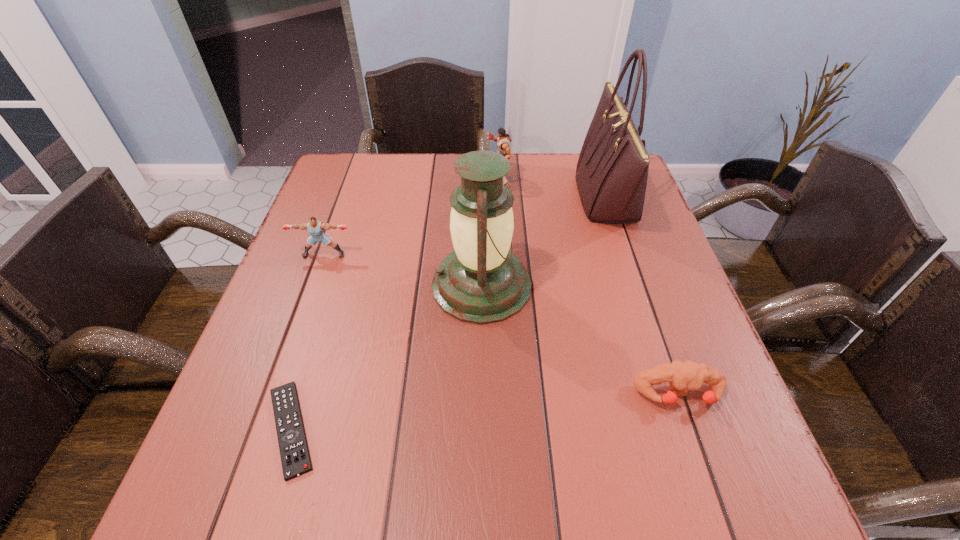
Image resolution: width=960 pixels, height=540 pixels. Identify the location of vacant space positioned 0.220m on the back of the shortest object. (333, 294).

The height and width of the screenshot is (540, 960). I want to click on handbag located at the far edge, so click(x=612, y=170).

The height and width of the screenshot is (540, 960). Find the location of `puncher that is at the far edge`. puncher that is at the far edge is located at coordinates (503, 141).

Where is `object that is at the near edge`? The height and width of the screenshot is (540, 960). object that is at the near edge is located at coordinates (295, 458).

At what (x,y) coordinates should I click in order to perform the action: click on puncher that is at the left edge. Please return your answer as a coordinate pair (x, y). The image size is (960, 540). Looking at the image, I should click on (x=315, y=228).

Locate an element on the screen. remote control that is at the left edge is located at coordinates (295, 458).

At what (x,y) coordinates should I click in order to perform the action: click on handbag that is at the right edge. Please return your answer as a coordinate pair (x, y). The height and width of the screenshot is (540, 960). Looking at the image, I should click on (612, 170).

The height and width of the screenshot is (540, 960). Find the location of `puncher located at the right edge`. puncher located at the right edge is located at coordinates [683, 376].

Image resolution: width=960 pixels, height=540 pixels. I want to click on object situated at the near left corner, so click(x=295, y=458).

At what (x,y) coordinates should I click in order to perform the action: click on object positioned at the far right corner. Please return your answer as a coordinate pair (x, y). The height and width of the screenshot is (540, 960). Looking at the image, I should click on (612, 170).